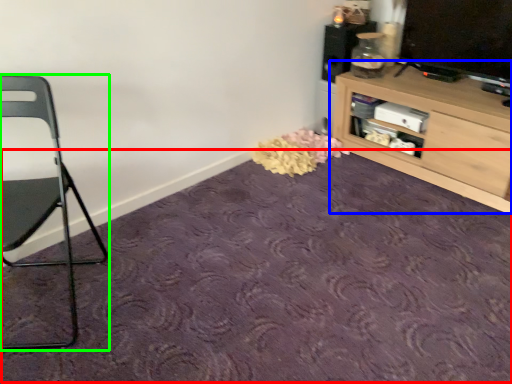
Question: Considering the real-world distances, which object is closest to plain (highlighted by a red box)? shelf (highlighted by a blue box) or chair (highlighted by a green box).

Choices:
 (A) shelf
 (B) chair

Answer: (B)